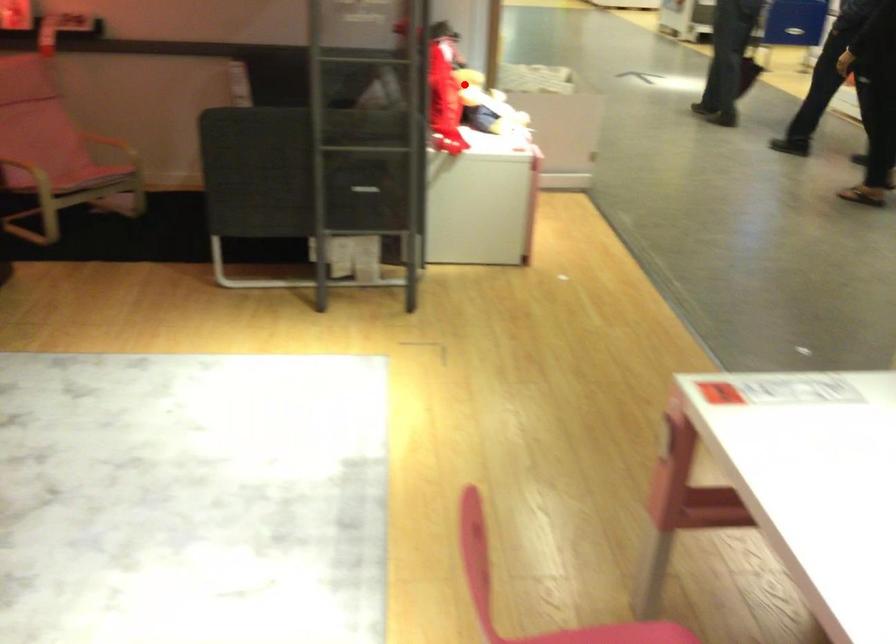
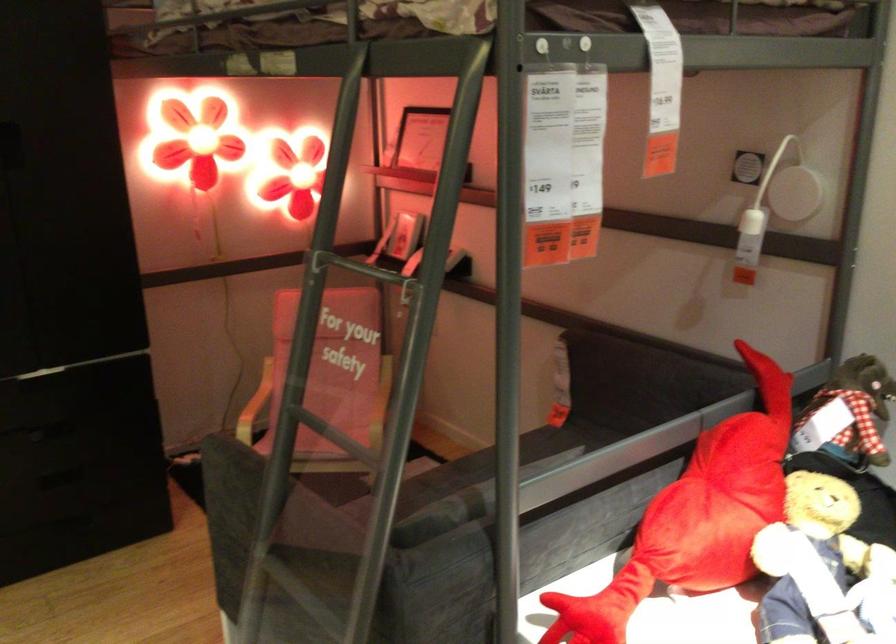
Question: I am providing you with two images of the same scene from different viewpoints. Image1 has a red point marked. In image2, the corresponding 3D location appears at what relative position? Reply with the corresponding letter.

Choices:
 (A) Closer
 (B) Farther

Answer: (A)